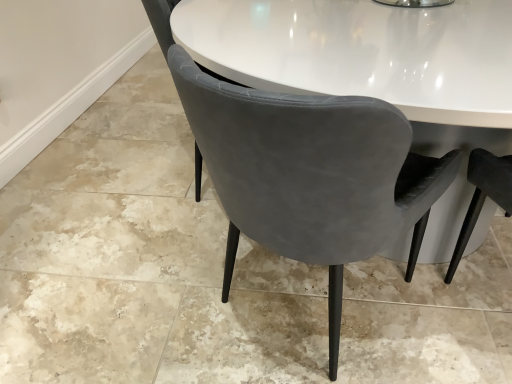
Locate an element on the screen. This screenshot has width=512, height=384. suede gray chair at center is located at coordinates (309, 174).

The image size is (512, 384). Describe the element at coordinates (309, 174) in the screenshot. I see `suede gray chair at center` at that location.

The image size is (512, 384). What are the coordinates of `suede gray chair at center` in the screenshot? It's located at (309, 174).